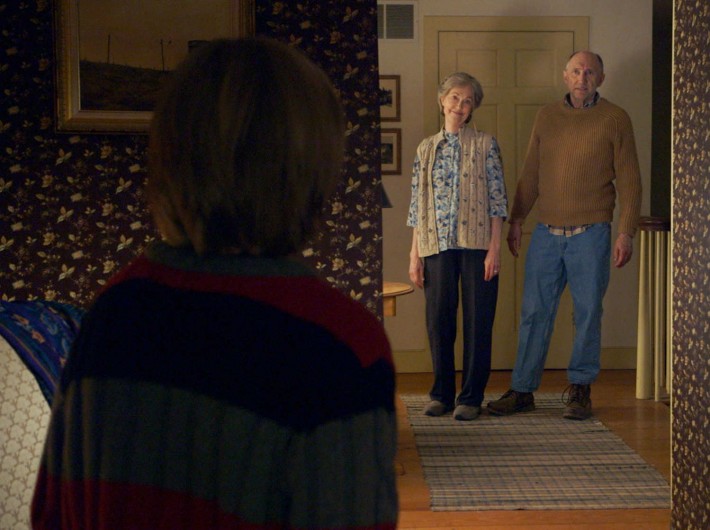
Locate an element on the screen. This screenshot has height=530, width=710. patterned wallpaper is located at coordinates (49, 225).